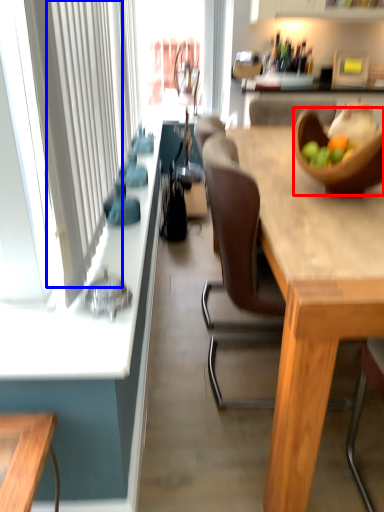
Question: Which object is closer to the camera taking this photo, bowl (highlighted by a red box) or curtain (highlighted by a blue box)?

Choices:
 (A) bowl
 (B) curtain

Answer: (B)